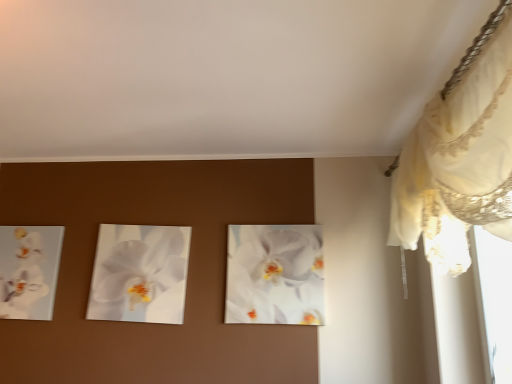
Question: Considering the relative sizes of white lace curtain at upper right and white glossy orchid at center, which is the 3th flower in left-to-right order, in the image provided, is white lace curtain at upper right taller than white glossy orchid at center, which is the 3th flower in left-to-right order,?

Choices:
 (A) no
 (B) yes

Answer: (B)

Question: Would you consider white lace curtain at upper right to be distant from white glossy orchid at center, which is the 3th flower in left-to-right order?

Choices:
 (A) no
 (B) yes

Answer: (A)

Question: Is white lace curtain at upper right smaller than white glossy orchid at center, positioned as the first flower in right-to-left order?

Choices:
 (A) yes
 (B) no

Answer: (B)

Question: Is white lace curtain at upper right oriented away from white glossy orchid at center, which is the 3th flower in left-to-right order?

Choices:
 (A) yes
 (B) no

Answer: (B)

Question: Is white lace curtain at upper right facing towards white glossy orchid at center, which is the 3th flower in left-to-right order?

Choices:
 (A) no
 (B) yes

Answer: (B)

Question: Choose the correct answer: Is white glossy orchid at left, which ranks as the third flower in right-to-left order, inside white glossy orchid at center, which is the 3th flower in left-to-right order, or outside it?

Choices:
 (A) inside
 (B) outside

Answer: (B)

Question: From a real-world perspective, is white glossy orchid at left, which appears as the 1th flower when viewed from the left, positioned above or below white glossy orchid at center, which is the 3th flower in left-to-right order?

Choices:
 (A) below
 (B) above

Answer: (A)

Question: From their relative heights in the image, would you say white glossy orchid at left, which appears as the 1th flower when viewed from the left, is taller or shorter than white glossy orchid at center, positioned as the first flower in right-to-left order?

Choices:
 (A) tall
 (B) short

Answer: (B)

Question: Is white glossy orchid at left, which ranks as the third flower in right-to-left order, bigger or smaller than white glossy orchid at center, which is the 3th flower in left-to-right order?

Choices:
 (A) small
 (B) big

Answer: (A)

Question: From a real-world perspective, is white glossy orchid at center, which is the 2th flower from left to right, physically located above or below white glossy orchid at left, which appears as the 1th flower when viewed from the left?

Choices:
 (A) below
 (B) above

Answer: (B)

Question: Considering the positions of white glossy orchid at center, the 2th flower when ordered from right to left, and white glossy orchid at left, which ranks as the third flower in right-to-left order, in the image, is white glossy orchid at center, the 2th flower when ordered from right to left, bigger or smaller than white glossy orchid at left, which ranks as the third flower in right-to-left order,?

Choices:
 (A) small
 (B) big

Answer: (B)

Question: Is point (141, 301) positioned closer to the camera than point (24, 281)?

Choices:
 (A) closer
 (B) farther

Answer: (A)

Question: Is white glossy orchid at center, which is the 2th flower from left to right, to the left or to the right of white glossy orchid at left, which appears as the 1th flower when viewed from the left, in the image?

Choices:
 (A) left
 (B) right

Answer: (B)

Question: Looking at their shapes, would you say white glossy orchid at center, which is the 2th flower from left to right, is wider or thinner than white lace curtain at upper right?

Choices:
 (A) thin
 (B) wide

Answer: (A)

Question: Is point (123, 251) closer or farther from the camera than point (482, 46)?

Choices:
 (A) closer
 (B) farther

Answer: (B)